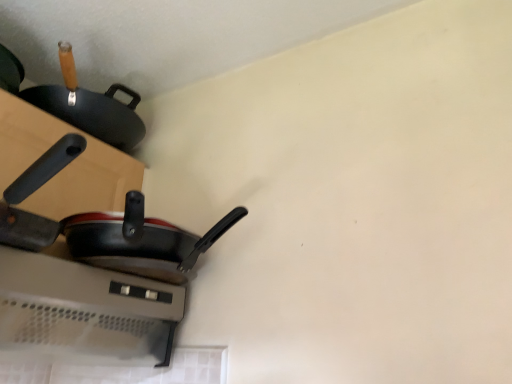
Question: From the image's perspective, is black matte frying pan at left, acting as the second frying pan starting from the back, located above or below black matte frying pan at lower left, positioned as the second frying pan in front-to-back order?

Choices:
 (A) above
 (B) below

Answer: (A)

Question: Relative to black matte frying pan at lower left, positioned as the second frying pan in front-to-back order, is black matte frying pan at left, the 1th frying pan viewed from the front, in front or behind?

Choices:
 (A) front
 (B) behind

Answer: (A)

Question: From a real-world perspective, is black matte frying pan at left, acting as the second frying pan starting from the back, positioned above or below black matte frying pan at lower left, positioned as the second frying pan in front-to-back order?

Choices:
 (A) above
 (B) below

Answer: (B)

Question: Is point (126, 264) closer or farther from the camera than point (58, 170)?

Choices:
 (A) closer
 (B) farther

Answer: (A)

Question: Based on their positions, is black matte frying pan at lower left, the 1th frying pan in the back-to-front sequence, located to the left or right of black matte frying pan at left, the 1th frying pan viewed from the front?

Choices:
 (A) right
 (B) left

Answer: (A)

Question: From a real-world perspective, relative to black matte frying pan at left, acting as the second frying pan starting from the back, is black matte frying pan at lower left, positioned as the second frying pan in front-to-back order, vertically above or below?

Choices:
 (A) above
 (B) below

Answer: (A)

Question: Is black matte frying pan at lower left, positioned as the second frying pan in front-to-back order, spatially inside black matte frying pan at left, acting as the second frying pan starting from the back, or outside of it?

Choices:
 (A) outside
 (B) inside

Answer: (A)